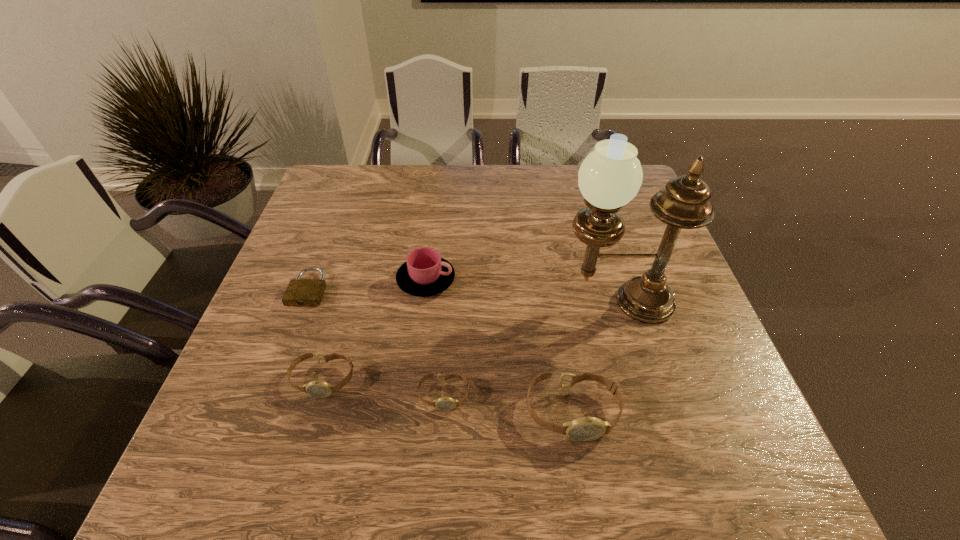
At what (x,y) coordinates should I click in order to perform the action: click on the leftmost watch. Please return your answer as a coordinate pair (x, y). The width and height of the screenshot is (960, 540). Looking at the image, I should click on (320, 389).

Find the location of a particular element. This screenshot has width=960, height=540. the second shortest watch is located at coordinates (320, 389).

The height and width of the screenshot is (540, 960). I want to click on the second watch from right to left, so click(x=445, y=403).

In order to click on the shortest watch in this screenshot , I will do `click(445, 403)`.

At what (x,y) coordinates should I click in order to perform the action: click on the rightmost watch. Please return your answer as a coordinate pair (x, y). The width and height of the screenshot is (960, 540). Looking at the image, I should click on pos(588,428).

The image size is (960, 540). In order to click on oil lamp in this screenshot , I will do `click(609, 177)`.

You are a GUI agent. You are given a task and a screenshot of the screen. Output one action in this format:
    pyautogui.click(x=<x>, y=<y>)
    Task: Click on the cup
    
    Given the screenshot: What is the action you would take?
    pyautogui.click(x=425, y=273)

Locate an element on the screen. This screenshot has width=960, height=540. the shortest object is located at coordinates (301, 292).

Locate an element on the screen. The width and height of the screenshot is (960, 540). vacant space located on the front of the tallest object is located at coordinates (648, 415).

The height and width of the screenshot is (540, 960). I want to click on blank space located on the side with the handle of the cup, so click(x=516, y=280).